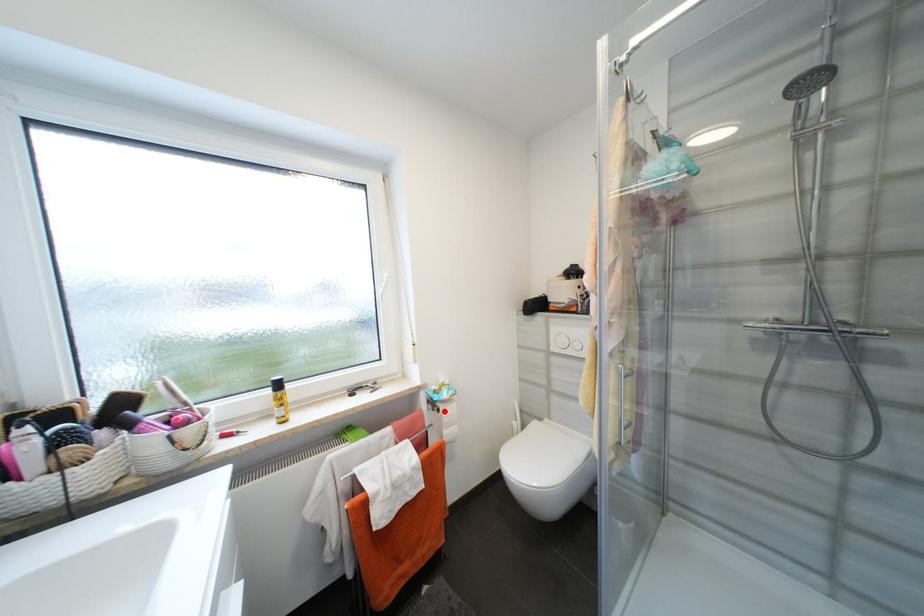
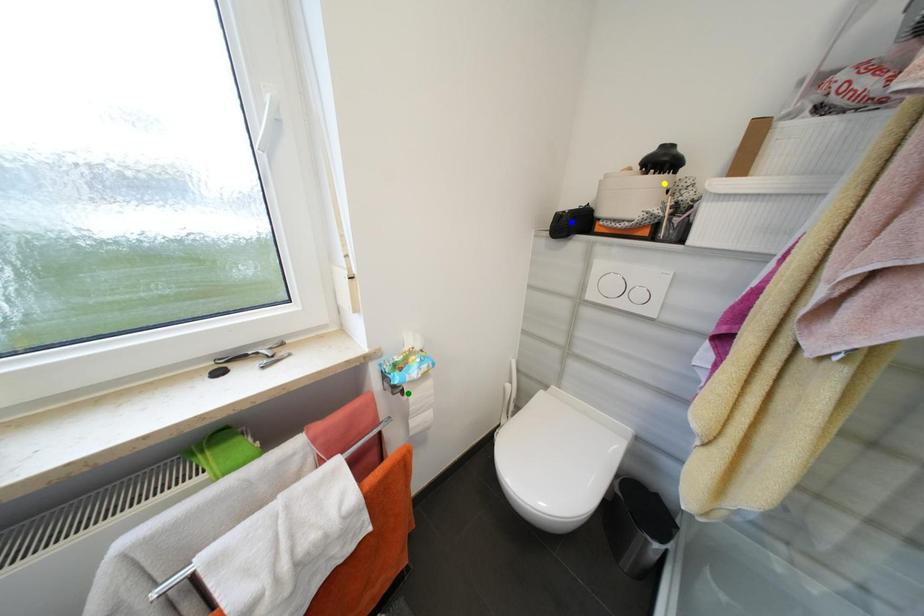
Question: I am providing you with two images of the same scene from different viewpoints. A red point is marked on the first image. You are given multiple points on the second image. Which point in image 2 is actually the same real-world point as the red point in image 1?

Choices:
 (A) green point
 (B) blue point
 (C) yellow point

Answer: (A)